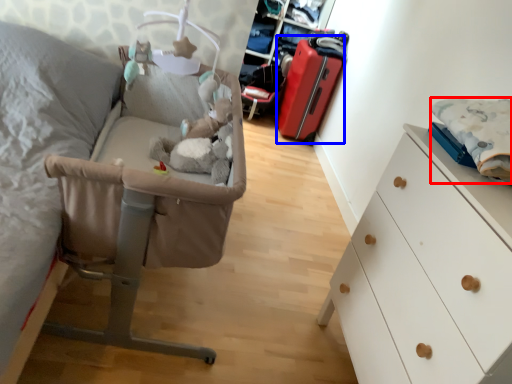
Question: Which object is further to the camera taking this photo, linen (highlighted by a red box) or luggage (highlighted by a blue box)?

Choices:
 (A) linen
 (B) luggage

Answer: (B)